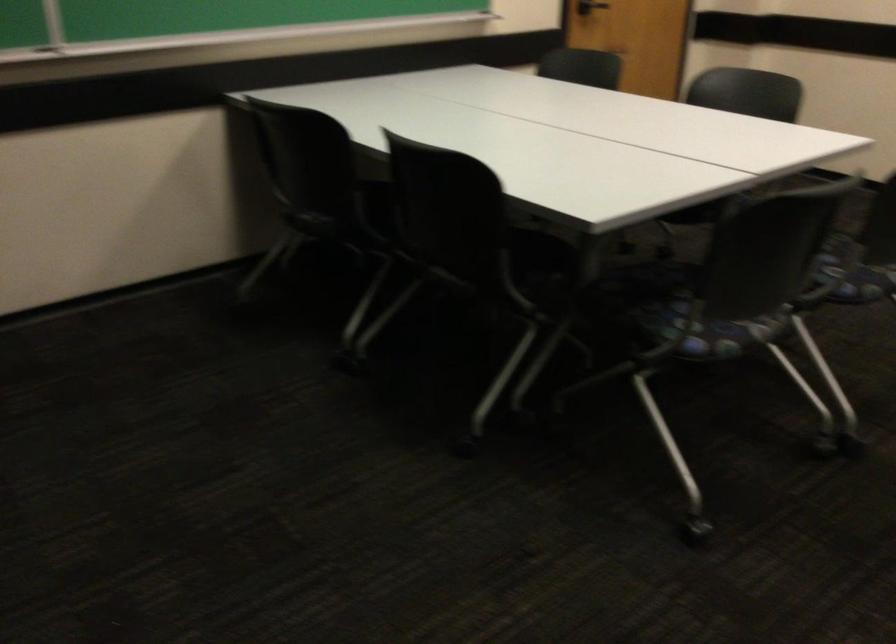
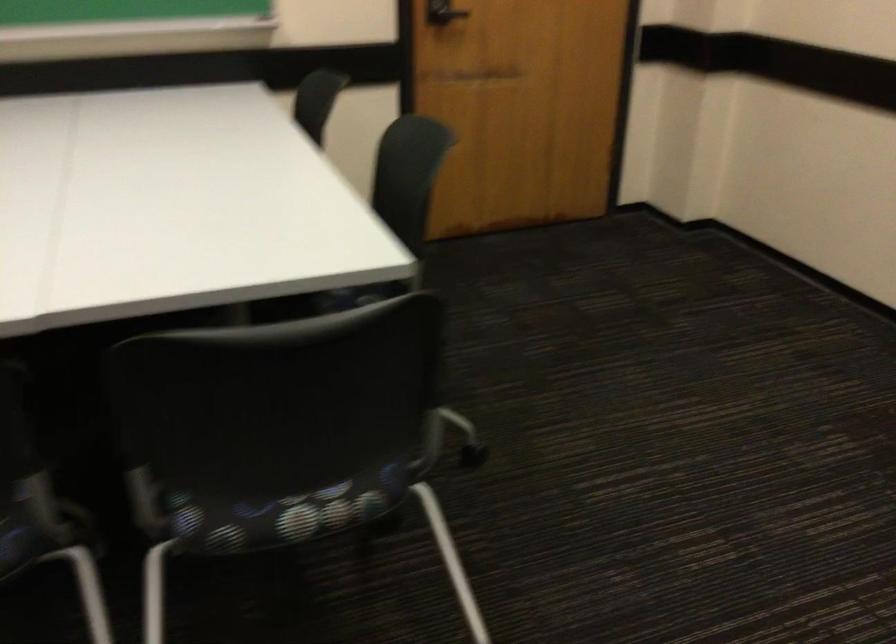
In a continuous first-person perspective shot, in which direction is the camera moving?

The cameraman walked toward right, forward.